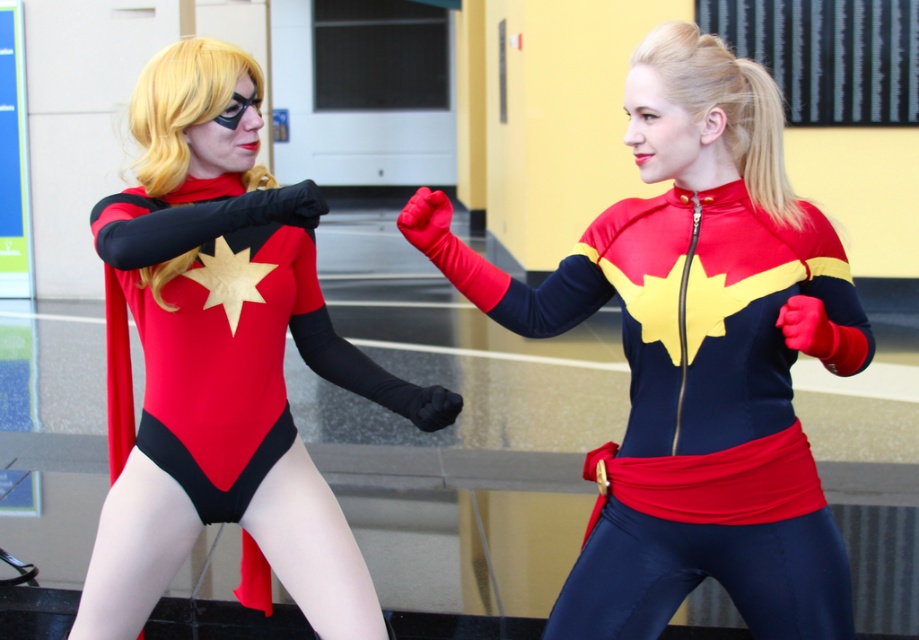
Who is positioned more to the left, shiny spandex suit at center or matte black bodysuit at left?

matte black bodysuit at left

Between point (842, 304) and point (109, 515), which one is positioned in front?

Point (842, 304) is more forward.

Is point (564, 280) positioned after point (135, 324)?

No, (564, 280) is in front of (135, 324).

The height and width of the screenshot is (640, 919). In order to click on shiny spandex suit at center in this screenshot , I will do `click(695, 356)`.